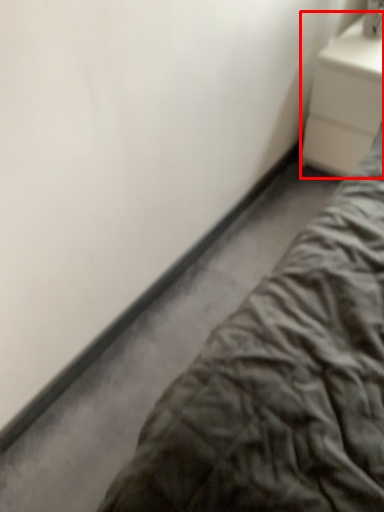
Question: From the image's perspective, what is the correct spatial relationship of nightstand (annotated by the red box) in relation to bed?

Choices:
 (A) above
 (B) below

Answer: (A)